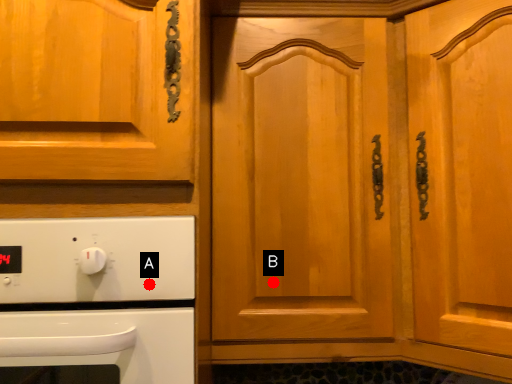
Question: Two points are circled on the image, labeled by A and B beside each circle. Among these points, which one is nearest to the camera?

Choices:
 (A) A is closer
 (B) B is closer

Answer: (A)